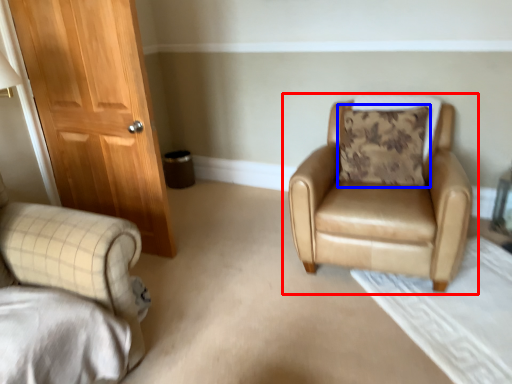
Question: Which of the following is the closest to the observer, chair (highlighted by a red box) or pillow (highlighted by a blue box)?

Choices:
 (A) chair
 (B) pillow

Answer: (A)